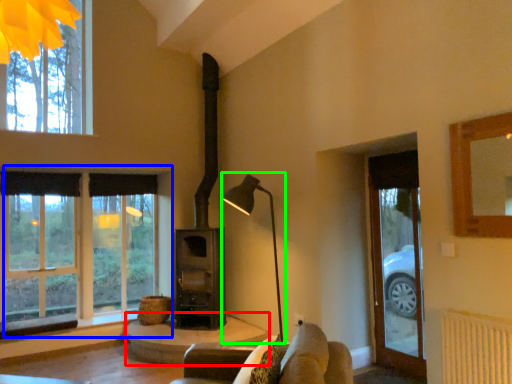
Question: Which object is the farthest from table (highlighted by a red box)? Choose among these: window (highlighted by a blue box) or table lamp (highlighted by a green box).

Choices:
 (A) window
 (B) table lamp

Answer: (A)